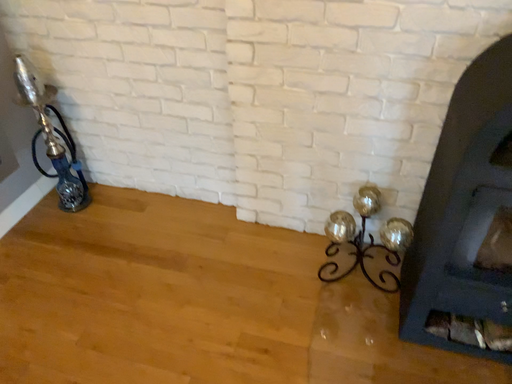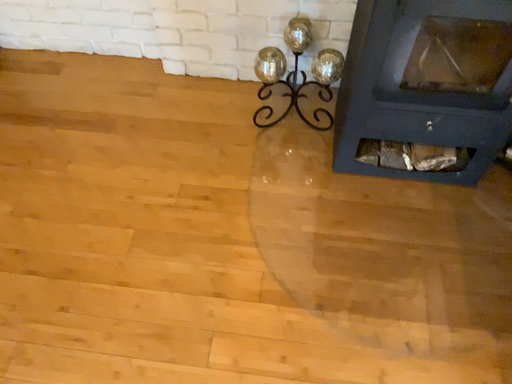
Question: Which way did the camera rotate in the video?

Choices:
 (A) rotated upward
 (B) rotated downward

Answer: (B)